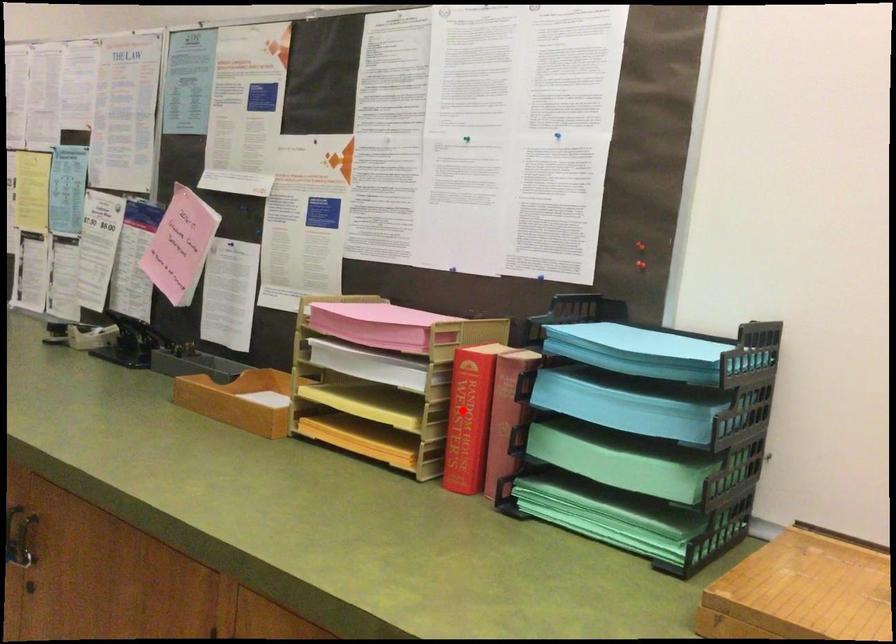
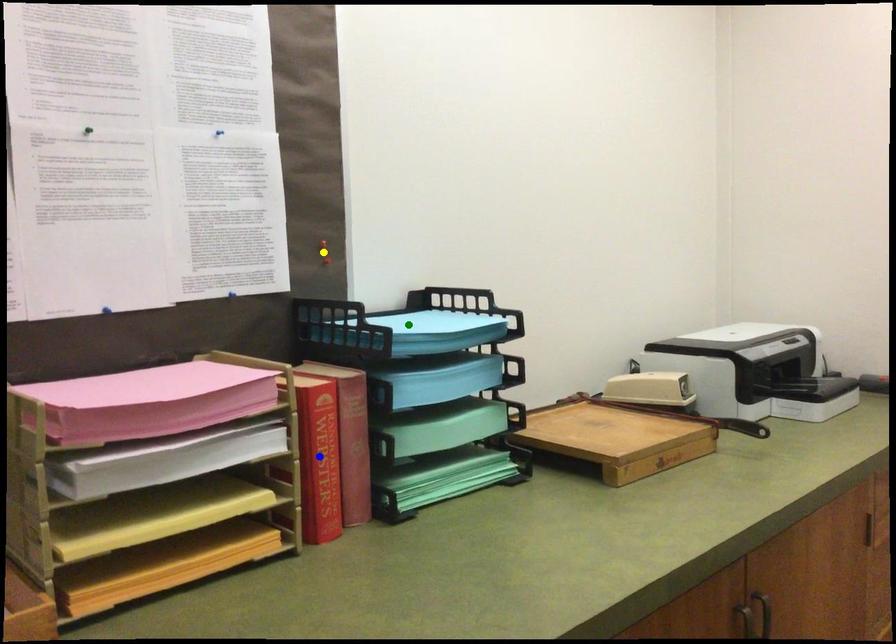
Question: I am providing you with two images of the same scene from different viewpoints. A red point is marked on the first image. You are given multiple points on the second image. Which spot in image 2 lines up with the point in image 1?

Choices:
 (A) green point
 (B) blue point
 (C) yellow point

Answer: (B)